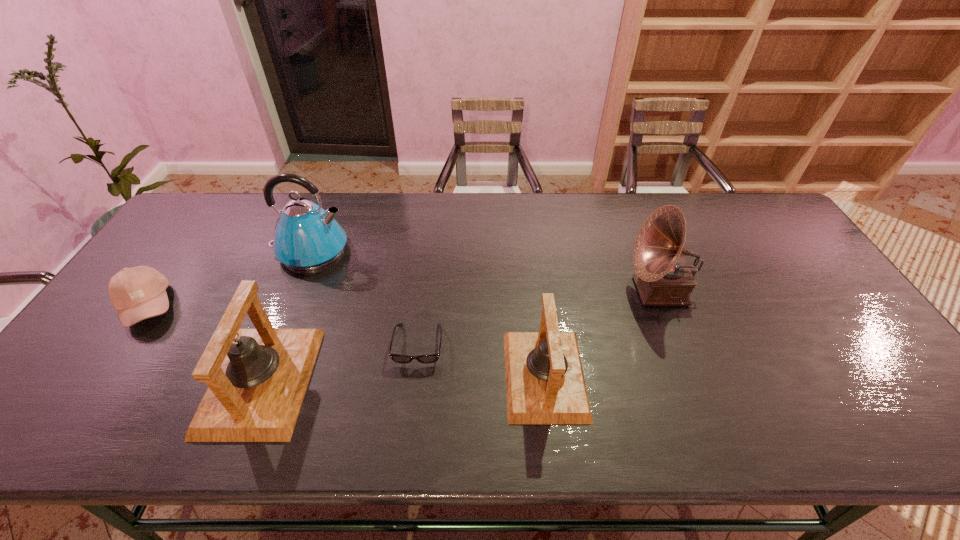
Locate an element on the screen. the left bell is located at coordinates (257, 378).

Find the location of a particular element. The width and height of the screenshot is (960, 540). the third tallest object is located at coordinates (257, 378).

Locate an element on the screen. the fifth object from left to right is located at coordinates (545, 384).

Find the location of `the right bell`. the right bell is located at coordinates (545, 384).

You are a GUI agent. You are given a task and a screenshot of the screen. Output one action in this format:
    pyautogui.click(x=<x>, y=<y>)
    Task: Click on the kettle
    This screenshot has height=540, width=960.
    Given the screenshot: What is the action you would take?
    pyautogui.click(x=307, y=237)

This screenshot has width=960, height=540. I want to click on the rightmost object, so click(663, 279).

You are a GUI agent. You are given a task and a screenshot of the screen. Output one action in this format:
    pyautogui.click(x=<x>, y=<y>)
    Task: Click on the baseball cap
    The image size is (960, 540).
    Given the screenshot: What is the action you would take?
    pyautogui.click(x=137, y=293)

The width and height of the screenshot is (960, 540). What are the coordinates of `the leftmost object` in the screenshot? It's located at (137, 293).

Identify the location of the third object from right to left. The width and height of the screenshot is (960, 540). (426, 359).

I want to click on spectacles, so click(426, 359).